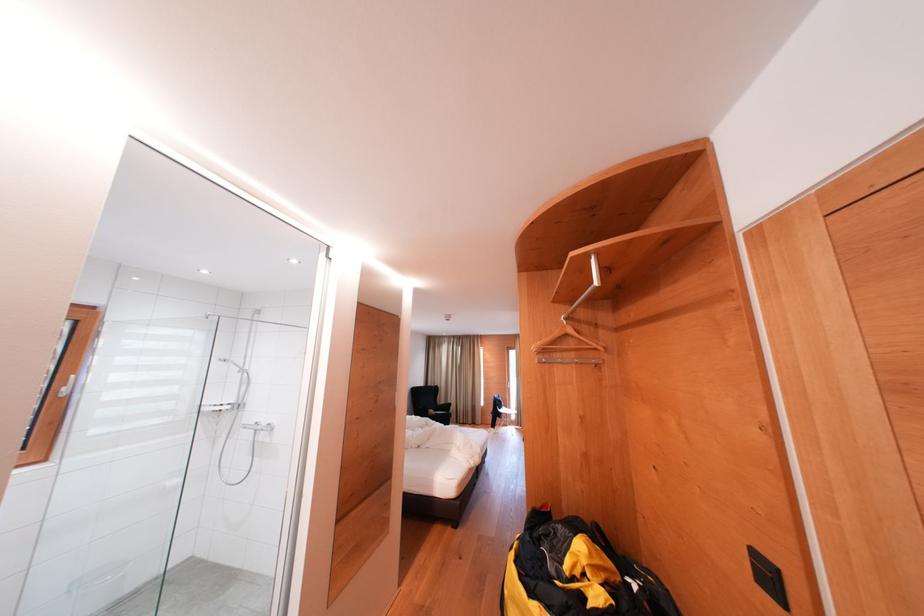
The height and width of the screenshot is (616, 924). What do you see at coordinates (768, 578) in the screenshot? I see `the black wall switch` at bounding box center [768, 578].